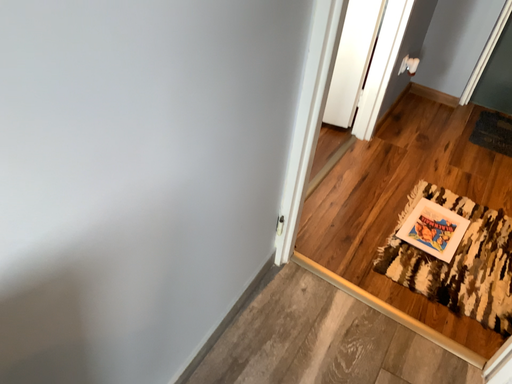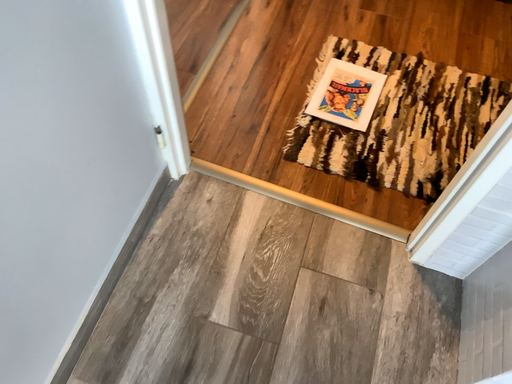
Question: Which way did the camera rotate in the video?

Choices:
 (A) rotated downward
 (B) rotated upward

Answer: (A)